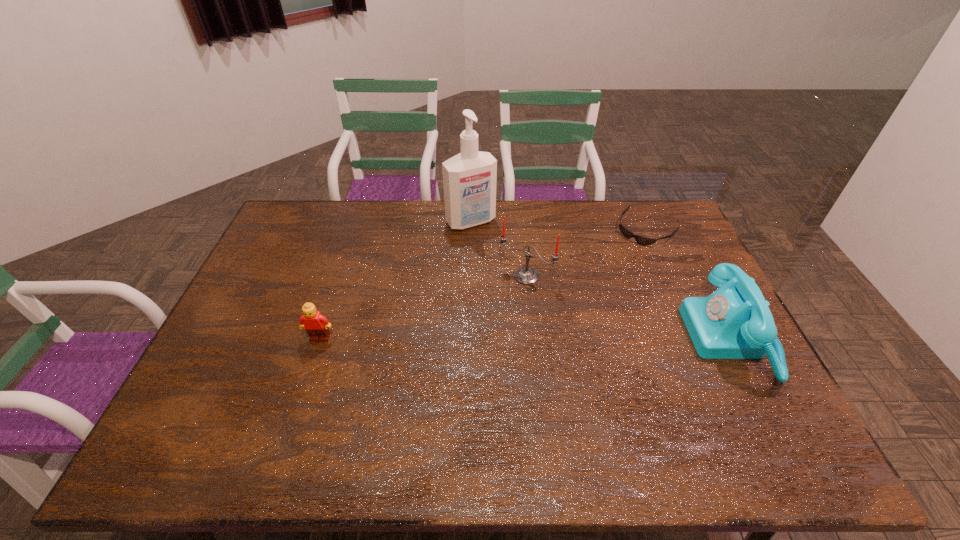
Where is `vacant space at the left edge of the desktop`? This screenshot has width=960, height=540. vacant space at the left edge of the desktop is located at coordinates (237, 349).

At what (x,y) coordinates should I click in order to perform the action: click on vacant space at the right edge. Please return your answer as a coordinate pair (x, y). Looking at the image, I should click on (687, 273).

Where is `free space at the far right corner of the desktop`? free space at the far right corner of the desktop is located at coordinates (647, 208).

At what (x,y) coordinates should I click in order to perform the action: click on blank area at the near right corner. Please return your answer as a coordinate pair (x, y). The width and height of the screenshot is (960, 540). Looking at the image, I should click on (761, 388).

The image size is (960, 540). Find the location of `vacant space that is in between the third object from left to right and the second shortest object`. vacant space that is in between the third object from left to right and the second shortest object is located at coordinates (423, 307).

At what (x,y) coordinates should I click in order to perform the action: click on blank region between the telephone and the fourth object from right to left. Please return your answer as a coordinate pair (x, y). This screenshot has width=960, height=540. Looking at the image, I should click on (601, 280).

You are a GUI agent. You are given a task and a screenshot of the screen. Output one action in this format:
    pyautogui.click(x=<x>, y=<y>)
    Task: Click on the empty space that is in between the telephone and the Lego
    
    Given the screenshot: What is the action you would take?
    pyautogui.click(x=526, y=339)

Find the location of a particular element. The image size is (960, 540). free space that is in between the candle and the shortest object is located at coordinates (586, 253).

I want to click on free space between the shortest object and the Lego, so click(483, 284).

The height and width of the screenshot is (540, 960). I want to click on vacant region between the fourth tallest object and the telephone, so click(526, 339).